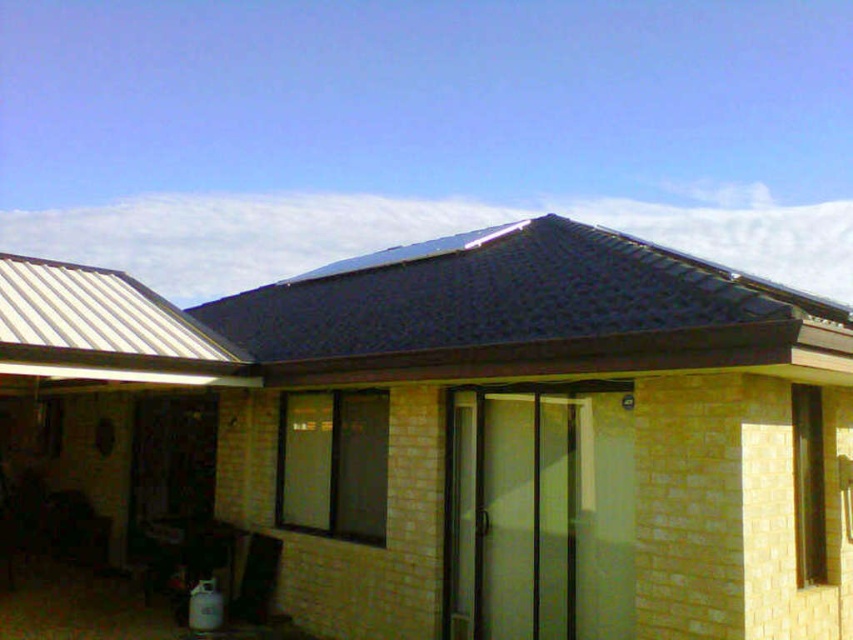
You are planning to install a new satellite dish on the side of the house. The satellite dish requires a mounting point that is at least 10 feet above the ground. Given the yellow brick shed at center and the black tile roof at upper center, which object would provide a suitable mounting location based on their heights?

The yellow brick shed at center has a greater height compared to the black tile roof at upper center. Therefore, the yellow brick shed at center would provide a suitable mounting location as it meets the required height of at least 10 feet.

You are standing at the entrance of the residential building and want to locate the yellow brick shed at center. According to the coordinates provided, in which direction should you look to find it?

The yellow brick shed at center is located at coordinates point (474, 435), so you should look towards the center of the image to find it.